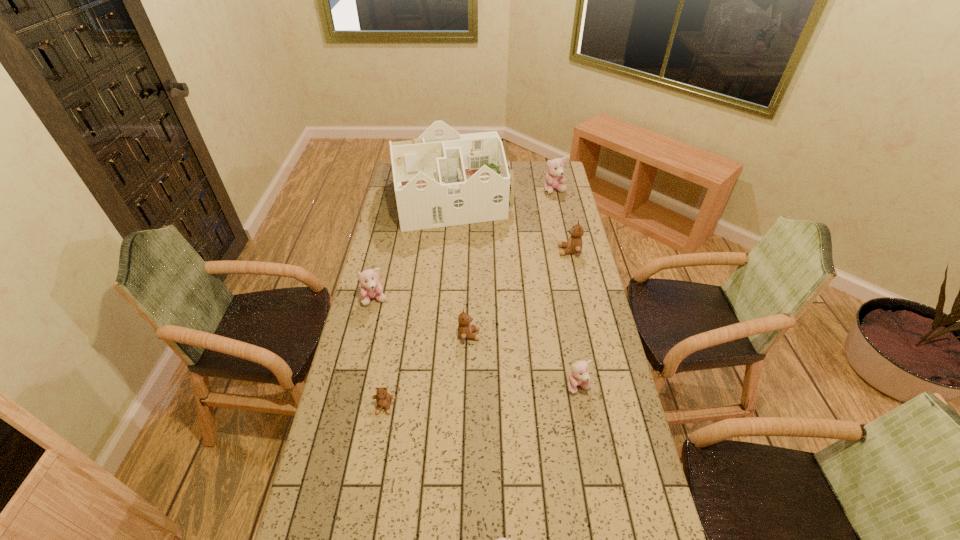
Where is `the second nearest pink teddy bear`? Image resolution: width=960 pixels, height=540 pixels. the second nearest pink teddy bear is located at coordinates (579, 376).

You are a GUI agent. You are given a task and a screenshot of the screen. Output one action in this format:
    pyautogui.click(x=<x>, y=<y>)
    Task: Click on the third nearest object
    This screenshot has height=540, width=960.
    Given the screenshot: What is the action you would take?
    pyautogui.click(x=579, y=376)

Find the location of `the second teddy bear from left to right`. the second teddy bear from left to right is located at coordinates pyautogui.click(x=383, y=399).

I want to click on the smallest brown teddy bear, so click(x=383, y=399).

Image resolution: width=960 pixels, height=540 pixels. In order to click on vacant space located 0.350m on the front of the white dollhouse in this screenshot , I will do `click(444, 286)`.

Identify the location of vacant space positioned at the face of the farthest pink teddy bear. (558, 204).

I want to click on vacant space located 0.330m at the face of the third smallest pink teddy bear, so (x=356, y=382).

Where is `free point located 0.110m on the front-facing side of the second farthest teddy bear`? free point located 0.110m on the front-facing side of the second farthest teddy bear is located at coordinates (533, 251).

Locate an element on the screen. This screenshot has height=540, width=960. vacant space situated 0.390m on the front-facing side of the second farthest teddy bear is located at coordinates (469, 251).

This screenshot has width=960, height=540. I want to click on vacant point located on the front-facing side of the second farthest teddy bear, so click(x=496, y=251).